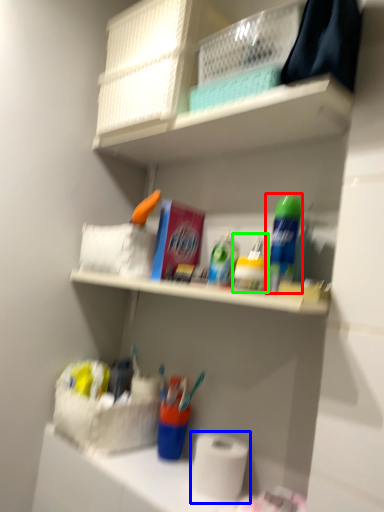
Question: Based on their relative distances, which object is nearer to cleaning product (highlighted by a red box)? Choose from toilet paper (highlighted by a blue box) and toiletry (highlighted by a green box).

Choices:
 (A) toilet paper
 (B) toiletry

Answer: (B)